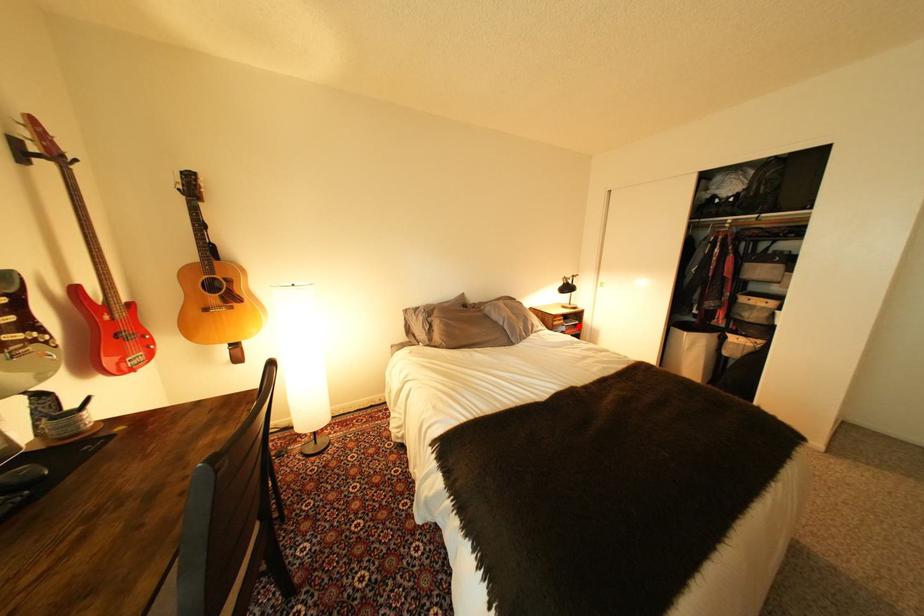
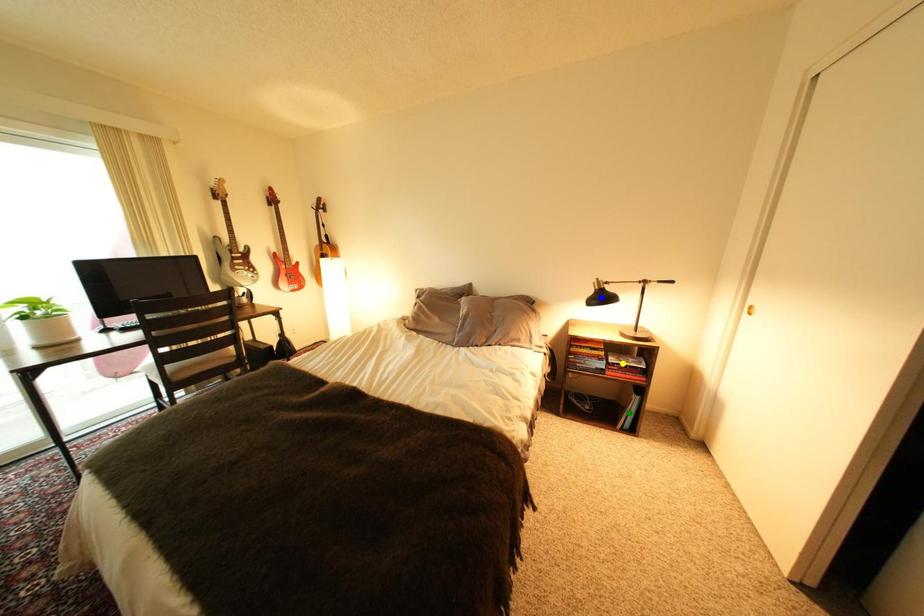
Question: I am providing you with two images of the same scene from different viewpoints. A red point is marked on the first image. You are given multiple points on the second image. Which spot in image 2 lines up with the point in image 1?

Choices:
 (A) green point
 (B) blue point
 (C) yellow point

Answer: (C)